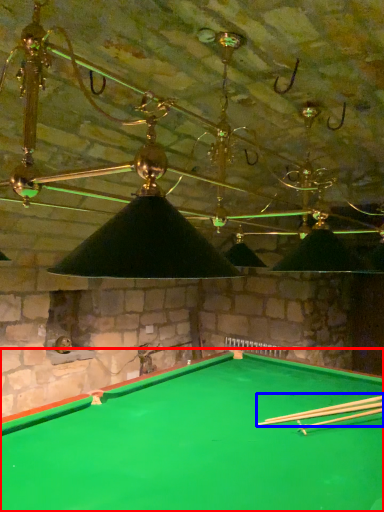
Question: Which object appears farthest to the camera in this image, billiard table (highlighted by a red box) or cue (highlighted by a blue box)?

Choices:
 (A) billiard table
 (B) cue

Answer: (B)